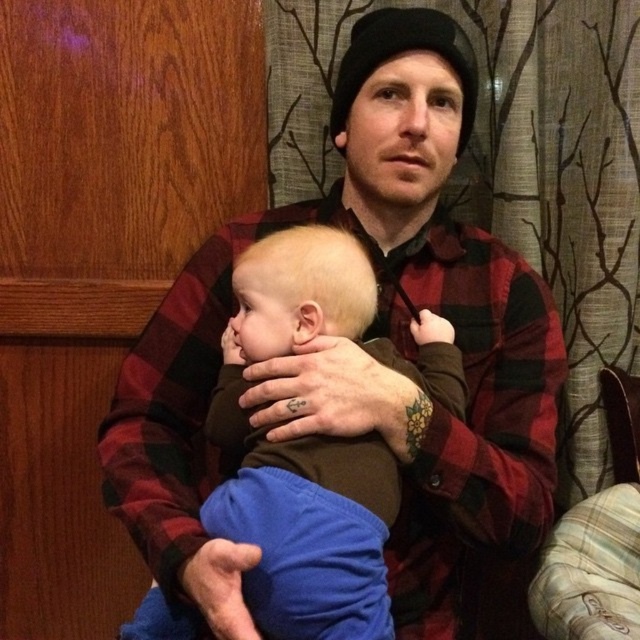
You are a photographer setting up a shoot in this scene. You need to position a small prop between the flannel shirt at center and the brown soft fabric baby at center. Based on their heights, which object should the prop be placed closer to?

The flannel shirt at center is taller than the brown soft fabric baby at center, so the prop should be placed closer to the brown soft fabric baby at center to ensure it is visible and balanced between the two objects.

You are a photographer setting up a shoot in this room. You need to position a light source so that it illuminates both the flannel shirt at center and the brown soft fabric baby at center without casting harsh shadows. Considering their positions, where should you place the light source relative to the camera?

The flannel shirt at center is below the brown soft fabric baby at center. To avoid harsh shadows, the light source should be placed above the camera, ensuring it reaches both the baby above and the shirt below evenly.

You are a photographer setting up a shoot in this room. You need to position a light source to the left of the flannel shirt at center and another to the right of the brown soft fabric baby at center. Given their positions, will the two light sources be placed on the same side of the room?

The flannel shirt at center is to the right of the brown soft fabric baby at center. Therefore, placing a light source to the left of the flannel shirt and to the right of the baby would mean the two light sources are on opposite sides of the room.